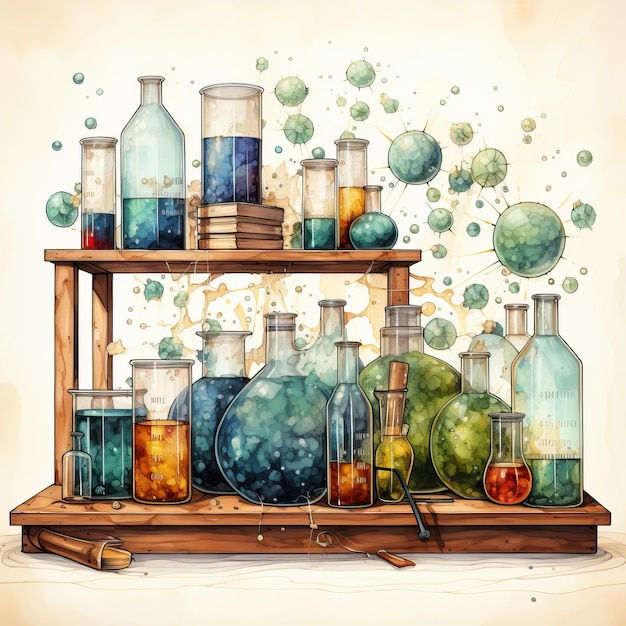
The width and height of the screenshot is (626, 626). I want to click on wooden rack, so click(255, 252).